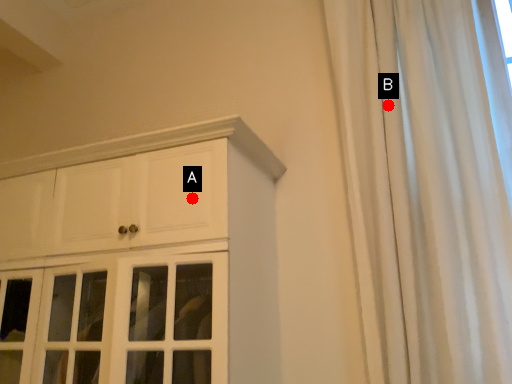
Question: Two points are circled on the image, labeled by A and B beside each circle. Which point is further to the camera?

Choices:
 (A) A is further
 (B) B is further

Answer: (B)